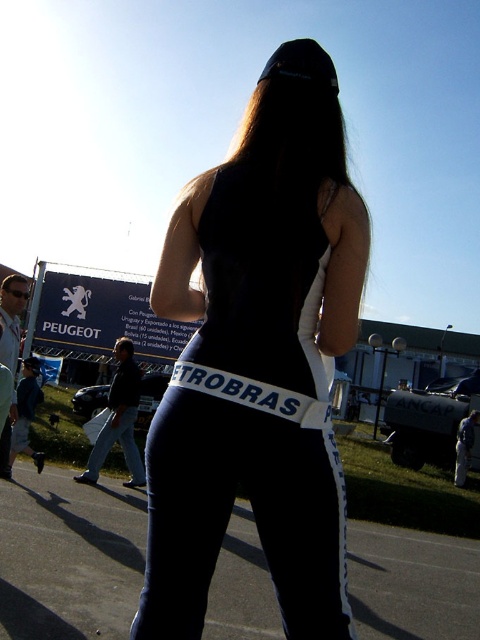
Question: Which point is closer to the camera?

Choices:
 (A) (321, 525)
 (B) (313, 204)

Answer: (A)

Question: Is black matte tank top at center closer to the viewer compared to navy blue leggings at center?

Choices:
 (A) no
 (B) yes

Answer: (A)

Question: Does black matte tank top at center appear on the right side of navy blue leggings at center?

Choices:
 (A) no
 (B) yes

Answer: (A)

Question: Can you confirm if black matte tank top at center is bigger than navy blue leggings at center?

Choices:
 (A) yes
 (B) no

Answer: (A)

Question: Which point is farther to the camera?

Choices:
 (A) (300, 586)
 (B) (351, 284)

Answer: (B)